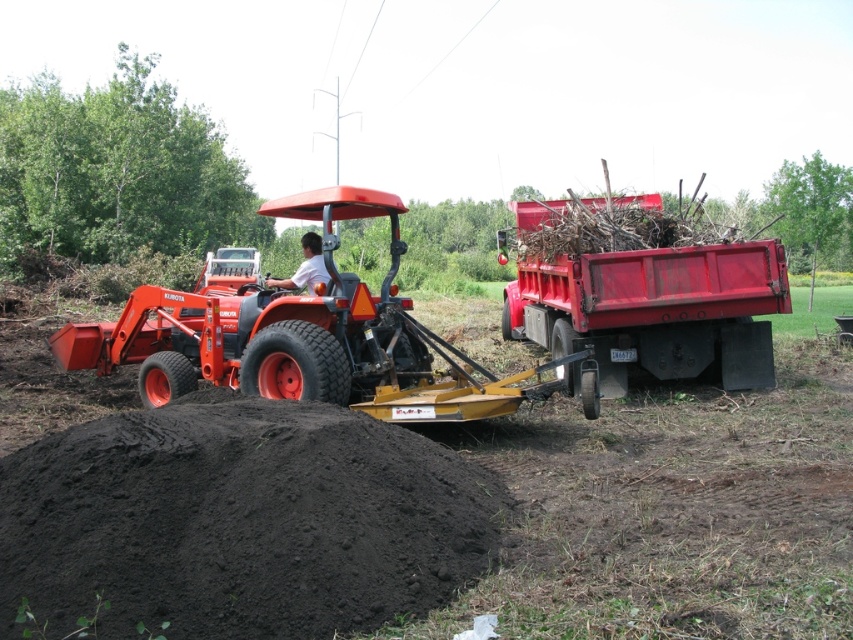
Question: Estimate the real-world distances between objects in this image. Which object is closer to the matte orange tractor at center?

Choices:
 (A) red matte trailer truck at right
 (B) white matte shirt at center
 (C) black soil at lower left

Answer: (C)

Question: Is matte orange tractor at center thinner than white matte shirt at center?

Choices:
 (A) yes
 (B) no

Answer: (A)

Question: Can you confirm if black soil at lower left is positioned to the left of red matte trailer truck at right?

Choices:
 (A) no
 (B) yes

Answer: (B)

Question: Does red matte trailer truck at right appear under white matte shirt at center?

Choices:
 (A) no
 (B) yes

Answer: (A)

Question: Which object appears farthest from the camera in this image?

Choices:
 (A) white matte shirt at center
 (B) red matte trailer truck at right

Answer: (B)

Question: Estimate the real-world distances between objects in this image. Which object is farther from the matte orange tractor at center?

Choices:
 (A) red matte trailer truck at right
 (B) black soil at lower left

Answer: (A)